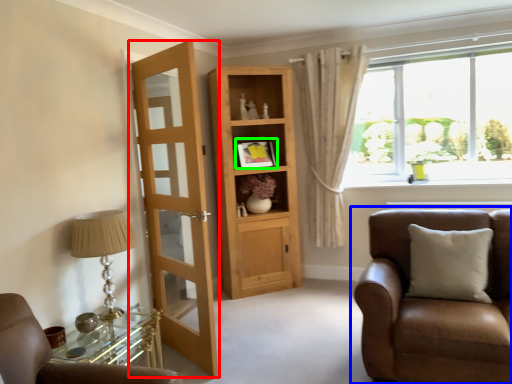
Question: Which is nearer to the door (highlighted by a red box)? chair (highlighted by a blue box) or picture frame (highlighted by a green box).

Choices:
 (A) chair
 (B) picture frame

Answer: (B)